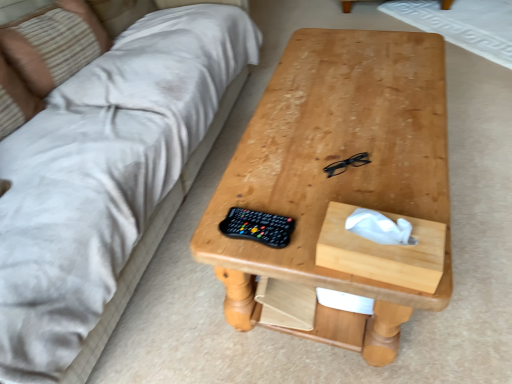
In order to click on free space in front of black plastic glasses at center in this screenshot , I will do `click(362, 195)`.